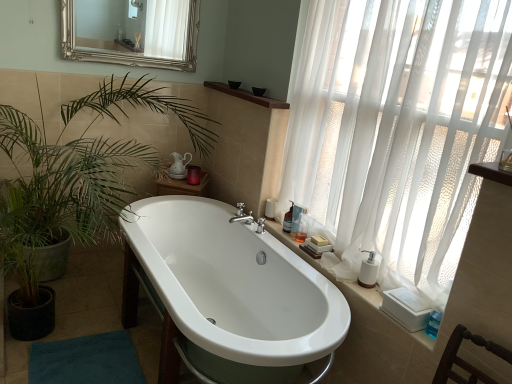
Question: Is silver/gilded mirror at upper center aimed at translucent plastic bottle at right, which ranks as the first toiletry in back-to-front order?

Choices:
 (A) yes
 (B) no

Answer: (B)

Question: Does silver/gilded mirror at upper center have a smaller size compared to translucent plastic bottle at right, which appears as the 3th toiletry when viewed from the front?

Choices:
 (A) no
 (B) yes

Answer: (A)

Question: Are silver/gilded mirror at upper center and translucent plastic bottle at right, which ranks as the first toiletry in back-to-front order, making contact?

Choices:
 (A) yes
 (B) no

Answer: (B)

Question: Is silver/gilded mirror at upper center further to the viewer compared to translucent plastic bottle at right, which ranks as the first toiletry in back-to-front order?

Choices:
 (A) yes
 (B) no

Answer: (A)

Question: Can you confirm if silver/gilded mirror at upper center is positioned to the left of translucent plastic bottle at right, which ranks as the first toiletry in back-to-front order?

Choices:
 (A) no
 (B) yes

Answer: (B)

Question: From a real-world perspective, is silver/gilded mirror at upper center positioned over translucent plastic bottle at right, which appears as the 3th toiletry when viewed from the front, based on gravity?

Choices:
 (A) yes
 (B) no

Answer: (A)

Question: From a real-world perspective, is translucent plastic bottle at right, which appears as the 3th toiletry when viewed from the front, located higher than translucent plastic bottle at right, which is the first toiletry from front to back?

Choices:
 (A) yes
 (B) no

Answer: (B)

Question: Is translucent plastic bottle at right, which ranks as the first toiletry in back-to-front order, to the right of translucent plastic bottle at right, arranged as the third toiletry when viewed from the back, from the viewer's perspective?

Choices:
 (A) no
 (B) yes

Answer: (A)

Question: Does translucent plastic bottle at right, which ranks as the first toiletry in back-to-front order, have a lesser height compared to translucent plastic bottle at right, arranged as the third toiletry when viewed from the back?

Choices:
 (A) no
 (B) yes

Answer: (B)

Question: Is translucent plastic bottle at right, which appears as the 3th toiletry when viewed from the front, facing away from translucent plastic bottle at right, which is the first toiletry from front to back?

Choices:
 (A) no
 (B) yes

Answer: (A)

Question: From a real-world perspective, is translucent plastic bottle at right, which ranks as the first toiletry in back-to-front order, positioned under translucent plastic bottle at right, which is the first toiletry from front to back, based on gravity?

Choices:
 (A) yes
 (B) no

Answer: (A)

Question: Considering the relative positions of translucent plastic bottle at right, which appears as the 3th toiletry when viewed from the front, and translucent plastic bottle at right, arranged as the third toiletry when viewed from the back, in the image provided, is translucent plastic bottle at right, which appears as the 3th toiletry when viewed from the front, to the left of translucent plastic bottle at right, arranged as the third toiletry when viewed from the back, from the viewer's perspective?

Choices:
 (A) yes
 (B) no

Answer: (A)

Question: Is green leafy plant at left at the back of translucent plastic bottle at right, which ranks as the first toiletry in back-to-front order?

Choices:
 (A) yes
 (B) no

Answer: (B)